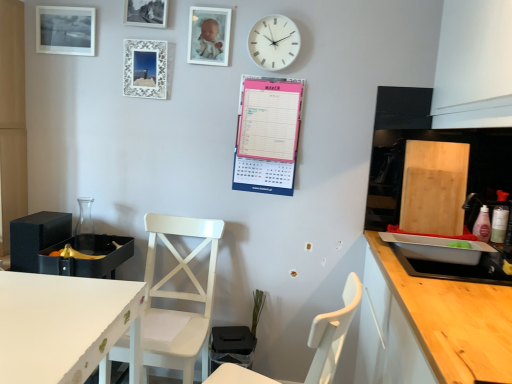
Question: Is metallic silver picture frame at upper center, the second picture frame in the right-to-left sequence, further to camera compared to wooden countertop at right?

Choices:
 (A) yes
 (B) no

Answer: (A)

Question: Can you see metallic silver picture frame at upper center, the second picture frame in the right-to-left sequence, touching wooden countertop at right?

Choices:
 (A) yes
 (B) no

Answer: (B)

Question: Is wooden countertop at right at the back of metallic silver picture frame at upper center, which is the third picture frame from left to right?

Choices:
 (A) no
 (B) yes

Answer: (A)

Question: Is metallic silver picture frame at upper center, the second picture frame in the right-to-left sequence, not within wooden countertop at right?

Choices:
 (A) yes
 (B) no

Answer: (A)

Question: Does metallic silver picture frame at upper center, the second picture frame in the right-to-left sequence, have a larger size compared to wooden countertop at right?

Choices:
 (A) no
 (B) yes

Answer: (A)

Question: Is point (295, 39) closer or farther from the camera than point (69, 46)?

Choices:
 (A) farther
 (B) closer

Answer: (B)

Question: From a real-world perspective, is white plastic wall clock at upper center above or below matte black picture frame at upper left, acting as the first picture frame starting from the left?

Choices:
 (A) below
 (B) above

Answer: (A)

Question: Considering the relative positions of white plastic wall clock at upper center and matte black picture frame at upper left, acting as the first picture frame starting from the left, in the image provided, is white plastic wall clock at upper center to the left or to the right of matte black picture frame at upper left, acting as the first picture frame starting from the left,?

Choices:
 (A) left
 (B) right

Answer: (B)

Question: Choose the correct answer: Is white plastic wall clock at upper center inside matte black picture frame at upper left, acting as the first picture frame starting from the left, or outside it?

Choices:
 (A) outside
 (B) inside

Answer: (A)

Question: From the image's perspective, is white plastic wall clock at upper center positioned above or below wooden countertop at right?

Choices:
 (A) above
 (B) below

Answer: (A)

Question: Relative to wooden countertop at right, is white plastic wall clock at upper center in front or behind?

Choices:
 (A) front
 (B) behind

Answer: (B)

Question: Considering the relative positions of white plastic wall clock at upper center and wooden countertop at right in the image provided, is white plastic wall clock at upper center to the left or to the right of wooden countertop at right?

Choices:
 (A) left
 (B) right

Answer: (A)

Question: Is white plastic wall clock at upper center inside or outside of wooden countertop at right?

Choices:
 (A) outside
 (B) inside

Answer: (A)

Question: Choose the correct answer: Is white wooden chair at center, placed as the second chair when sorted from back to front, inside metallic silver picture frame at upper center, which is the third picture frame from left to right, or outside it?

Choices:
 (A) outside
 (B) inside

Answer: (A)

Question: From the image's perspective, is white wooden chair at center, placed as the second chair when sorted from back to front, above or below metallic silver picture frame at upper center, which is the third picture frame from left to right?

Choices:
 (A) above
 (B) below

Answer: (B)